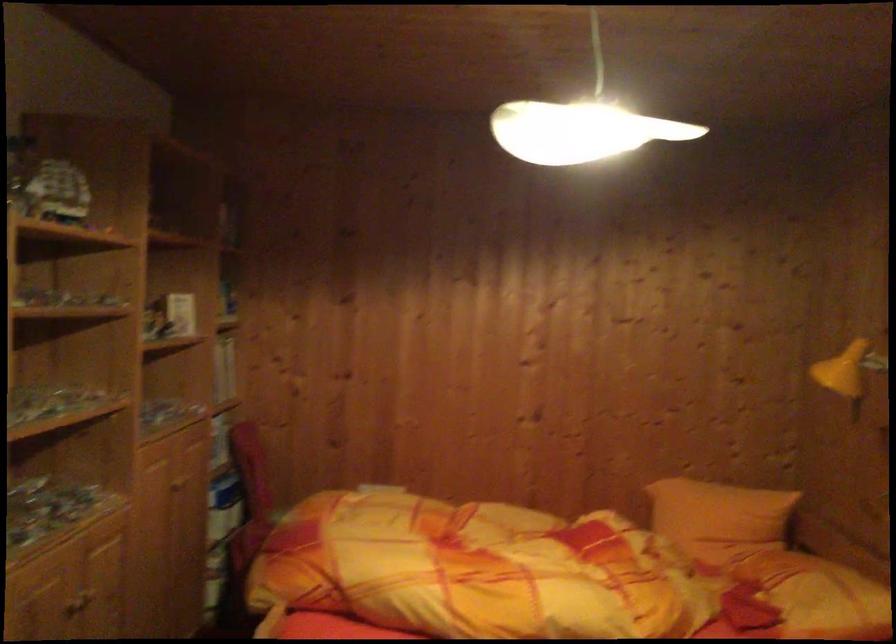
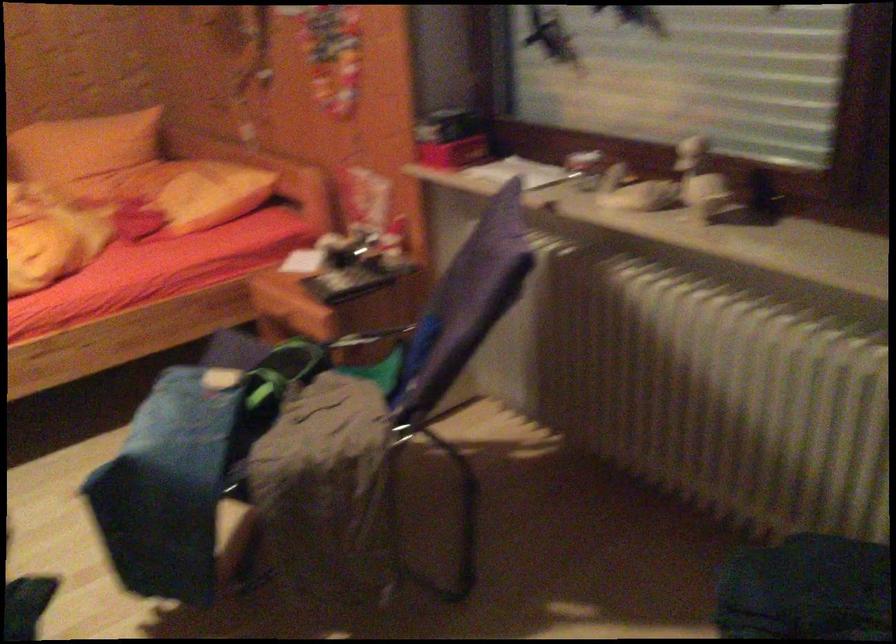
The first image is from the beginning of the video and the second image is from the end. How did the camera likely rotate when shooting the video?

The rotation direction of the camera is right-down.